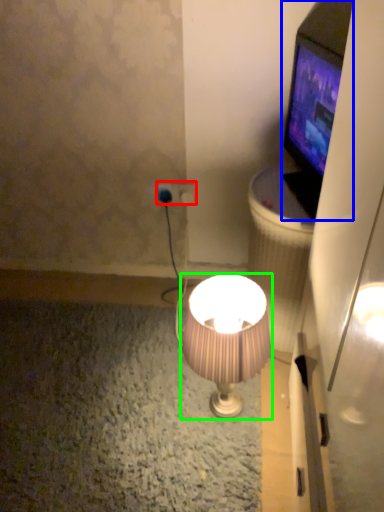
Question: Based on their relative distances, which object is nearer to power plugs and sockets (highlighted by a red box)? Choose from television (highlighted by a blue box) and lamp (highlighted by a green box).

Choices:
 (A) television
 (B) lamp

Answer: (A)